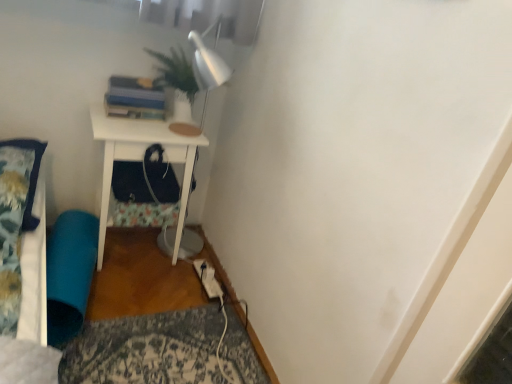
Question: Could you tell me if white matte nightstand at center is turned towards teal fabric bean bag at lower left?

Choices:
 (A) no
 (B) yes

Answer: (A)

Question: Is white matte nightstand at center outside teal fabric bean bag at lower left?

Choices:
 (A) no
 (B) yes

Answer: (B)

Question: Is white matte nightstand at center thinner than teal fabric bean bag at lower left?

Choices:
 (A) yes
 (B) no

Answer: (B)

Question: Can you confirm if white matte nightstand at center is wider than teal fabric bean bag at lower left?

Choices:
 (A) no
 (B) yes

Answer: (B)

Question: Is white matte nightstand at center closer to camera compared to teal fabric bean bag at lower left?

Choices:
 (A) yes
 (B) no

Answer: (B)

Question: From the image's perspective, is teal fabric bean bag at lower left above or below fluffy blue pillow at left?

Choices:
 (A) above
 (B) below

Answer: (B)

Question: In terms of height, does teal fabric bean bag at lower left look taller or shorter compared to fluffy blue pillow at left?

Choices:
 (A) short
 (B) tall

Answer: (B)

Question: In the image, is teal fabric bean bag at lower left positioned in front of or behind fluffy blue pillow at left?

Choices:
 (A) behind
 (B) front

Answer: (A)

Question: From a real-world perspective, is teal fabric bean bag at lower left above or below fluffy blue pillow at left?

Choices:
 (A) above
 (B) below

Answer: (B)

Question: From a real-world perspective, relative to teal fabric bean bag at lower left, is fluffy blue pillow at left vertically above or below?

Choices:
 (A) above
 (B) below

Answer: (A)

Question: In terms of size, does fluffy blue pillow at left appear bigger or smaller than teal fabric bean bag at lower left?

Choices:
 (A) small
 (B) big

Answer: (A)

Question: Is fluffy blue pillow at left inside or outside of teal fabric bean bag at lower left?

Choices:
 (A) outside
 (B) inside

Answer: (A)

Question: Is fluffy blue pillow at left wider or thinner than teal fabric bean bag at lower left?

Choices:
 (A) thin
 (B) wide

Answer: (B)

Question: Which is correct: teal fabric bean bag at lower left is inside white matte nightstand at center, or outside of it?

Choices:
 (A) outside
 (B) inside

Answer: (A)

Question: In the image, is teal fabric bean bag at lower left positioned in front of or behind white matte nightstand at center?

Choices:
 (A) front
 (B) behind

Answer: (A)